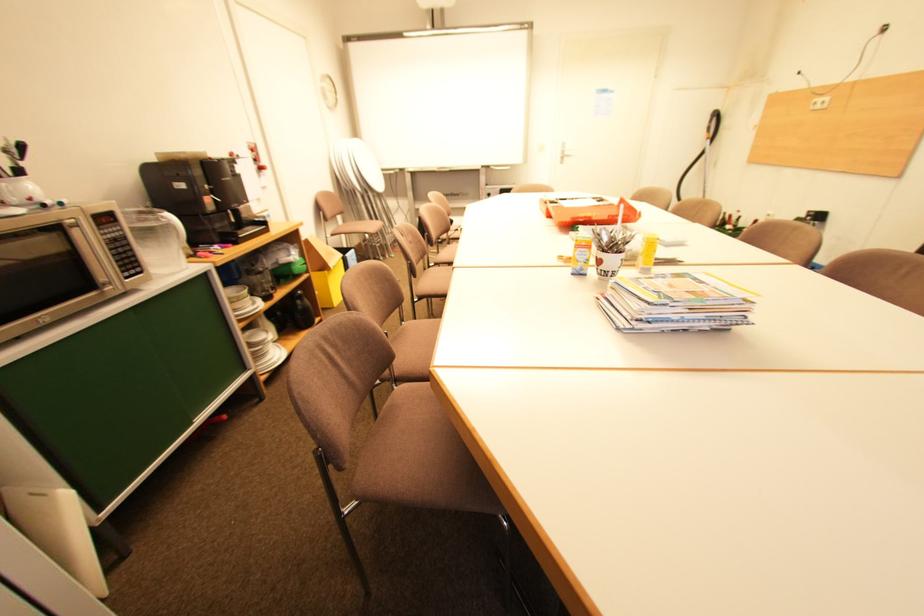
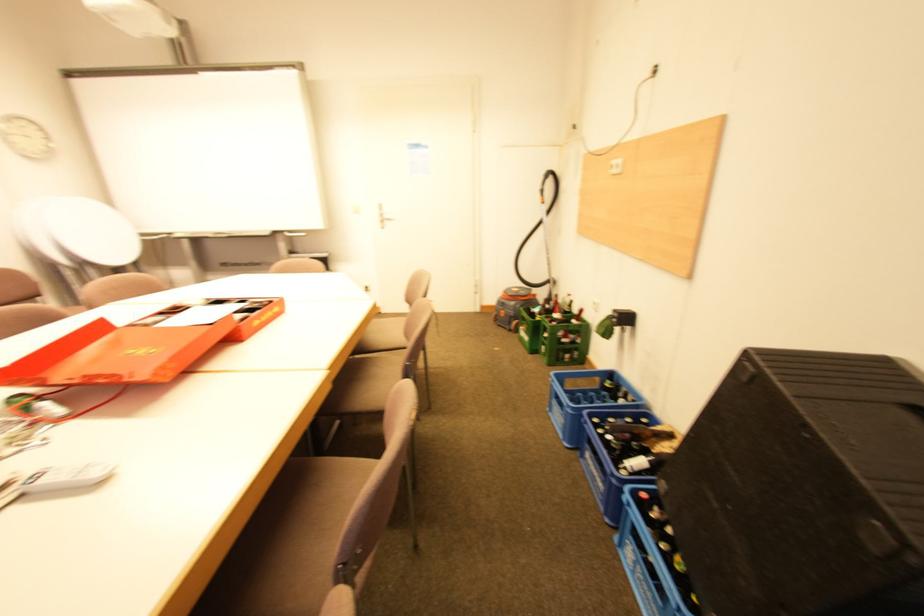
Looking at this image, the images are taken continuously from a first-person perspective. In which direction are you moving?

The cameraman moved toward right, forward.